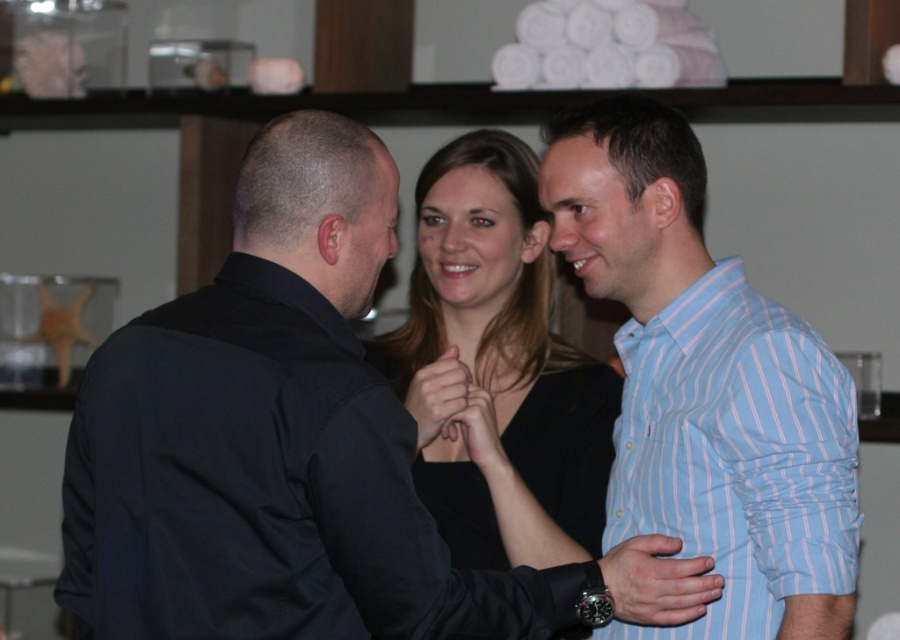
Question: Which of the following is the closest to the observer?

Choices:
 (A) light blue striped shirt at right
 (B) smooth skin hand at center
 (C) matte blue shirt at center
 (D) smooth black dress at center

Answer: (A)

Question: Which of these objects is positioned farthest from the light blue striped shirt at right?

Choices:
 (A) smooth black hand at center
 (B) smooth black dress at center
 (C) black matte dress at center

Answer: (A)

Question: Does matte blue shirt at center lie in front of smooth black hand at center?

Choices:
 (A) no
 (B) yes

Answer: (B)

Question: Which is nearer to the smooth skin hand at center?

Choices:
 (A) black matte dress at center
 (B) smooth black hand at center
 (C) smooth black dress at center

Answer: (B)

Question: Can you confirm if smooth skin hand at center is positioned to the right of smooth black hand at center?

Choices:
 (A) yes
 (B) no

Answer: (B)

Question: Does light blue striped shirt at right appear on the left side of smooth black hand at center?

Choices:
 (A) yes
 (B) no

Answer: (B)